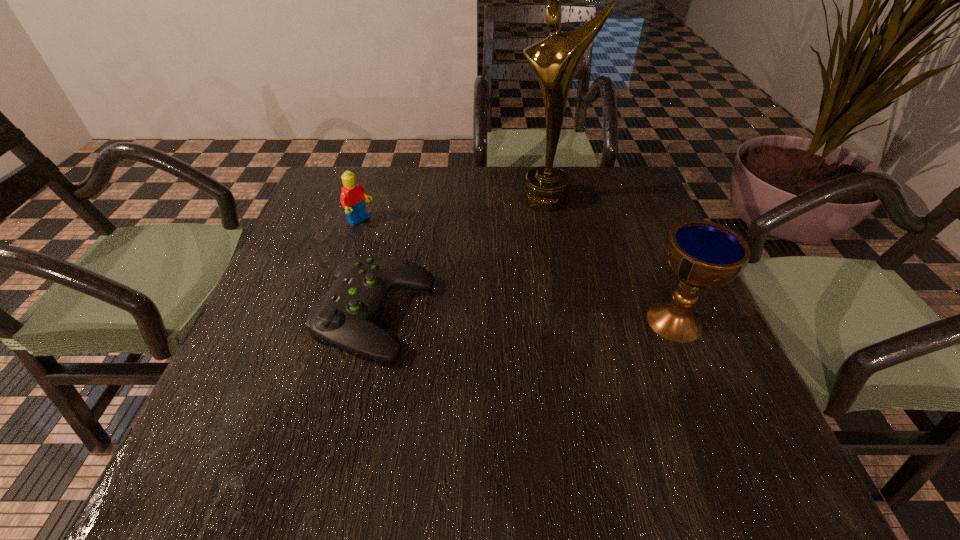
At what (x,y) coordinates should I click in order to perform the action: click on free space between the chalice and the award. Please return your answer as a coordinate pair (x, y). Looking at the image, I should click on (611, 260).

Locate an element on the screen. This screenshot has width=960, height=540. blank region between the shortest object and the farthest object is located at coordinates (461, 257).

At what (x,y) coordinates should I click in order to perform the action: click on vacant space that is in between the rightmost object and the second object from right to left. Please return your answer as a coordinate pair (x, y). Image resolution: width=960 pixels, height=540 pixels. Looking at the image, I should click on (611, 260).

You are a GUI agent. You are given a task and a screenshot of the screen. Output one action in this format:
    pyautogui.click(x=<x>, y=<y>)
    Task: Click on the free spot between the chalice and the farthest object
    
    Given the screenshot: What is the action you would take?
    pyautogui.click(x=611, y=260)

Where is `unoccupied area between the tallest object and the control`? unoccupied area between the tallest object and the control is located at coordinates (461, 257).

Locate an element on the screen. The height and width of the screenshot is (540, 960). vacant region between the tallest object and the Lego is located at coordinates click(453, 211).

The width and height of the screenshot is (960, 540). I want to click on the closest object to the award, so click(343, 316).

Identify the location of object identified as the third closest to the shortest object. (703, 254).

The width and height of the screenshot is (960, 540). Find the location of `vacant space that satisfies the following two spatial constraints: 1. on the front side of the chalice; 2. on the left side of the Lego`. vacant space that satisfies the following two spatial constraints: 1. on the front side of the chalice; 2. on the left side of the Lego is located at coordinates (329, 321).

Locate an element on the screen. free space that satisfies the following two spatial constraints: 1. on the back side of the third tallest object; 2. on the left side of the farthest object is located at coordinates (368, 199).